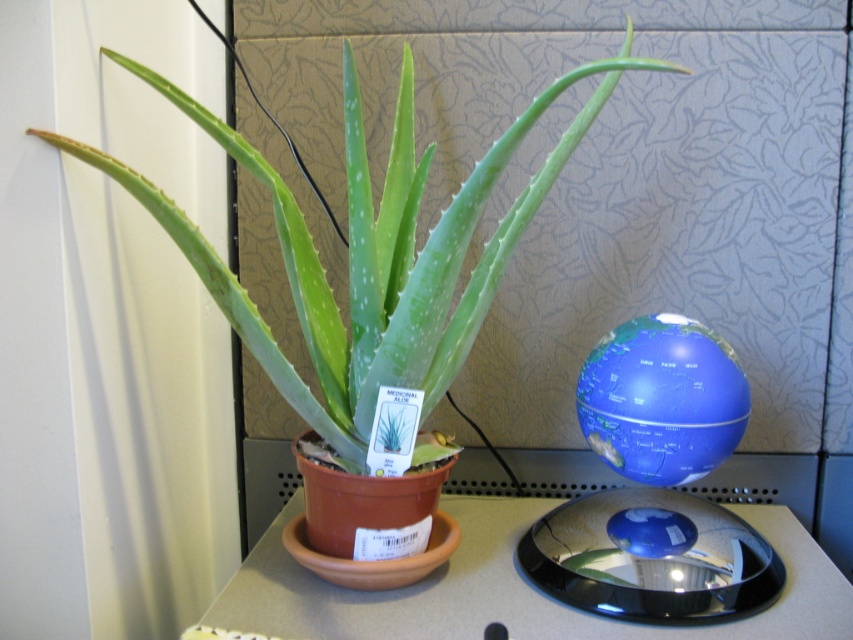
Question: Considering the relative positions of green matte/aquarium glass plant at left and smooth gray table at center in the image provided, where is green matte/aquarium glass plant at left located with respect to smooth gray table at center?

Choices:
 (A) above
 (B) below

Answer: (A)

Question: Does green matte/aquarium glass plant at left appear on the left side of smooth gray table at center?

Choices:
 (A) yes
 (B) no

Answer: (A)

Question: Considering the relative positions of green matte/aquarium glass plant at left and smooth gray table at center in the image provided, where is green matte/aquarium glass plant at left located with respect to smooth gray table at center?

Choices:
 (A) above
 (B) below

Answer: (A)

Question: Which object appears closest to the camera in this image?

Choices:
 (A) smooth gray table at center
 (B) green matte/aquarium glass plant at left

Answer: (B)

Question: Which of the following is the farthest from the observer?

Choices:
 (A) (358, 164)
 (B) (223, 588)

Answer: (B)

Question: Which object is closer to the camera taking this photo?

Choices:
 (A) smooth gray table at center
 (B) green matte/aquarium glass plant at left

Answer: (B)